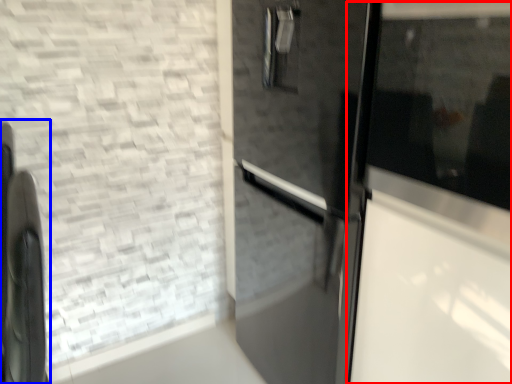
Question: Which object appears closest to the camera in this image, glass door (highlighted by a red box) or appliance (highlighted by a blue box)?

Choices:
 (A) glass door
 (B) appliance

Answer: (A)